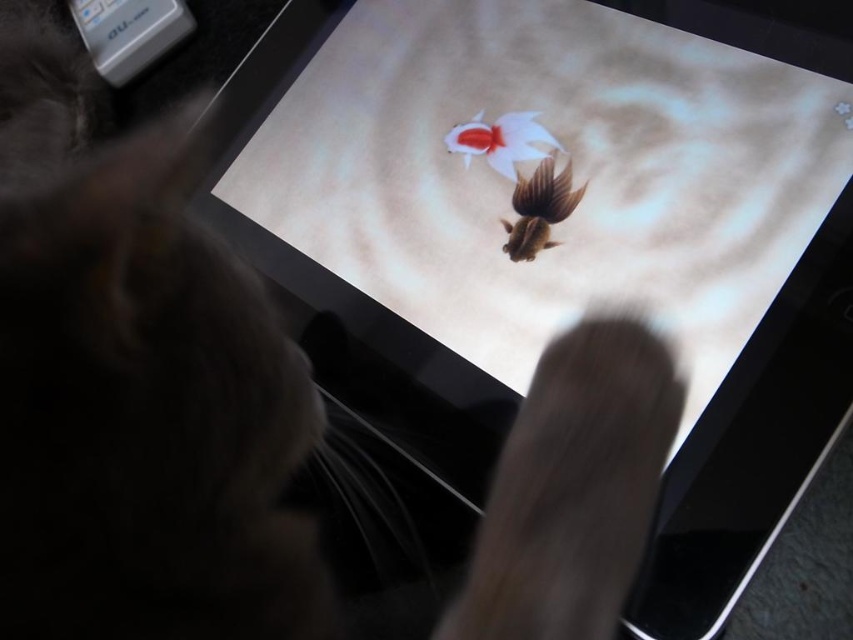
You are a cat trying to touch the shiny brown fish at center on the screen. The screen has a touch sensor at point (x=538, y=209). Can you reach the fish by touching the sensor at that point?

Yes, the shiny brown fish at center is located exactly at point (x=538, y=209), so touching the sensor there will allow you to reach it.

You are a cat staring at the screen with two fish. Which fish is closer to you, the shiny brown fish at center or the white glossy goldfish at center?

The shiny brown fish at center is in front of the white glossy goldfish at center, so the shiny brown fish at center is closer to you.

You are a cat who wants to touch the shiny brown fish at center on the screen. The screen is 18 inches away from your paws. Can you reach it?

The shiny brown fish at center is 20.08 inches away from the viewer, which is farther than the 18 inches distance of the screen. Therefore, you cannot reach it with your paws.